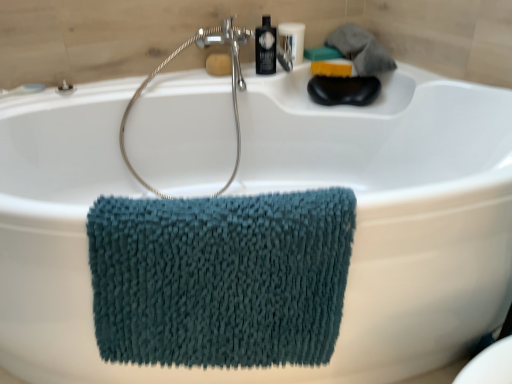
Question: From a real-world perspective, is black glossy bottle at upper center physically located above or below yellow sponge at upper right, which ranks as the 2th soap in left-to-right order?

Choices:
 (A) below
 (B) above

Answer: (B)

Question: In terms of height, does black glossy bottle at upper center look taller or shorter compared to yellow sponge at upper right, which is the first soap from right to left?

Choices:
 (A) short
 (B) tall

Answer: (B)

Question: Which object is positioned closest to the teal chenille towel at center?

Choices:
 (A) black glossy bottle at upper center
 (B) satin nickel showerhead at upper center
 (C) translucent plastic bottle at upper center
 (D) yellow sponge at upper right, which is the first soap from right to left
 (E) yellow sponge at upper center, which appears as the first soap when viewed from the left

Answer: (B)

Question: Which object is the closest to the black glossy bottle at upper center?

Choices:
 (A) yellow sponge at upper right, which ranks as the 2th soap in left-to-right order
 (B) satin nickel showerhead at upper center
 (C) yellow sponge at upper center, placed as the 2th soap when sorted from right to left
 (D) teal chenille towel at center
 (E) translucent plastic bottle at upper center

Answer: (E)